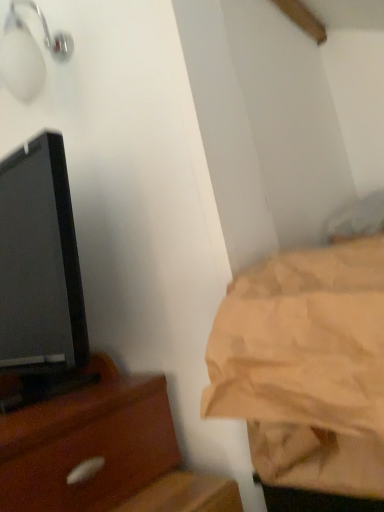
Question: Based on their sizes in the image, would you say beige fabric bedsheet at right is bigger or smaller than white glossy light fixture at upper left?

Choices:
 (A) small
 (B) big

Answer: (B)

Question: Is beige fabric bedsheet at right wider or thinner than white glossy light fixture at upper left?

Choices:
 (A) thin
 (B) wide

Answer: (B)

Question: Which of these objects is positioned farthest from the beige fabric bedsheet at right?

Choices:
 (A) white glossy light fixture at upper left
 (B) black glossy tv at left

Answer: (A)

Question: Which object is positioned closest to the black glossy tv at left?

Choices:
 (A) white glossy light fixture at upper left
 (B) beige fabric bedsheet at right

Answer: (A)